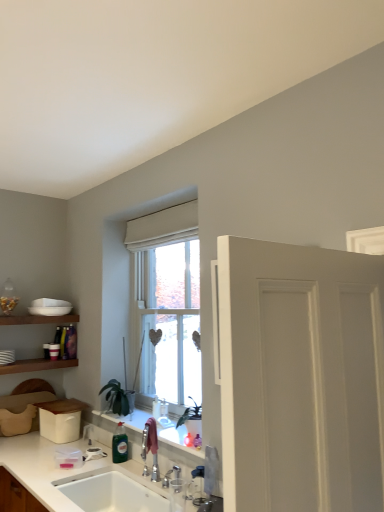
The width and height of the screenshot is (384, 512). Describe the element at coordinates (57, 469) in the screenshot. I see `white glossy countertop at lower center` at that location.

Find the location of a particular element. This screenshot has width=384, height=512. green matte plant at center is located at coordinates (118, 398).

Identify the location of white matte door at right. (301, 377).

From a real-world perspective, who is located lower, white glossy countertop at lower center or green matte plant at center?

white glossy countertop at lower center.

Who is smaller, white glossy countertop at lower center or green matte plant at center?

green matte plant at center.

Would you say white glossy countertop at lower center is to the left or to the right of green matte plant at center in the picture?

white glossy countertop at lower center is positioned on green matte plant at center's right side.

Is point (52, 506) positioned after point (112, 410)?

No, (52, 506) is in front of (112, 410).

From the image's perspective, is green glass bottle at sink beneath white glossy countertop at lower center?

No.

Looking at this image, can you confirm if green glass bottle at sink is smaller than white glossy countertop at lower center?

Yes.

Which is behind, point (123, 459) or point (79, 448)?

Point (79, 448)

How many degrees apart are the facing directions of green glass bottle at sink and white glossy countertop at lower center?

The angle between the facing direction of green glass bottle at sink and the facing direction of white glossy countertop at lower center is 3.65 degrees.

Is white matte door at right thinner than green glass bottle at sink?

Yes, white matte door at right is thinner than green glass bottle at sink.

Does white matte door at right have a larger size compared to green glass bottle at sink?

Indeed, white matte door at right has a larger size compared to green glass bottle at sink.

Relative to green glass bottle at sink, is white matte door at right in front or behind?

white matte door at right is in front of green glass bottle at sink.

Between point (30, 467) and point (140, 490), which one is positioned behind?

Point (30, 467)

Considering the relative sizes of white glossy countertop at lower center and white ceramic sink at lower left in the image provided, is white glossy countertop at lower center shorter than white ceramic sink at lower left?

Yes.

From a real-world perspective, which object stands above the other?

From a 3D spatial view, white glossy countertop at lower center is above.

From the image's perspective, relative to white glossy countertop at lower center, is white matte door at right above or below?

white matte door at right is situated higher than white glossy countertop at lower center in the image.

Considering the sizes of white matte door at right and white glossy countertop at lower center in the image, is white matte door at right taller or shorter than white glossy countertop at lower center?

white matte door at right is taller than white glossy countertop at lower center.

Looking at this image, who is bigger, white matte door at right or white glossy countertop at lower center?

white glossy countertop at lower center.

You are a GUI agent. You are given a task and a screenshot of the screen. Output one action in this format:
    pyautogui.click(x=<x>, y=<y>)
    Task: Click on the sink that is on the right side of green matte plant at center
    
    Given the screenshot: What is the action you would take?
    point(112,493)

Which object is further away from the camera, green matte plant at center or white ceramic sink at lower left?

green matte plant at center is further from the camera.

Is green matte plant at center wider than white ceramic sink at lower left?

No.

Relative to green glass bottle at sink, is white ceramic sink at lower left in front or behind?

In the image, white ceramic sink at lower left appears in front of green glass bottle at sink.

From a real-world perspective, is white ceramic sink at lower left located higher than green glass bottle at sink?

No, from a real-world perspective, white ceramic sink at lower left is not over green glass bottle at sink

Would you consider white ceramic sink at lower left to be distant from green glass bottle at sink?

No, white ceramic sink at lower left is not far from green glass bottle at sink.

Is white ceramic sink at lower left oriented away from green glass bottle at sink?

white ceramic sink at lower left does not have its back to green glass bottle at sink.

At what (x,y) coordinates should I click in order to perform the action: click on countertop that is below the green matte plant at center (from the image's perspective). Please return your answer as a coordinate pair (x, y). This screenshot has height=512, width=384. Looking at the image, I should click on (57, 469).

At what (x,y) coordinates should I click in order to perform the action: click on bottle behind the white glossy countertop at lower center. Please return your answer as a coordinate pair (x, y). Looking at the image, I should click on (119, 448).

Looking at the image, which one is located further to white ceramic sink at lower left, green glass bottle at sink or white glossy countertop at lower center?

Among the two, green glass bottle at sink is located further to white ceramic sink at lower left.

From the image, which object appears to be farther from white glossy countertop at lower center, white ceramic sink at lower left or green glass bottle at sink?

green glass bottle at sink is further to white glossy countertop at lower center.

When comparing their distances from green glass bottle at sink, does white matte door at right or white ceramic sink at lower left seem further?

white matte door at right is further to green glass bottle at sink.

Looking at the image, which one is located closer to white matte door at right, green matte plant at center or white glossy countertop at lower center?

The object closer to white matte door at right is white glossy countertop at lower center.

From the image, which object appears to be nearer to white ceramic sink at lower left, white glossy countertop at lower center or green matte plant at center?

Based on the image, white glossy countertop at lower center appears to be nearer to white ceramic sink at lower left.

When comparing their distances from green matte plant at center, does green glass bottle at sink or white glossy countertop at lower center seem further?

Based on the image, white glossy countertop at lower center appears to be further to green matte plant at center.

From the image, which object appears to be nearer to white glossy countertop at lower center, green matte plant at center or green glass bottle at sink?

green glass bottle at sink.

When comparing their distances from white glossy countertop at lower center, does white matte door at right or white ceramic sink at lower left seem closer?

Based on the image, white ceramic sink at lower left appears to be nearer to white glossy countertop at lower center.

Locate an element on the screen. This screenshot has width=384, height=512. sink between white glossy countertop at lower center and green glass bottle at sink from front to back is located at coordinates (112, 493).

Locate an element on the screen. The image size is (384, 512). sink between white matte door at right and green glass bottle at sink from front to back is located at coordinates (112, 493).

Identify the location of sink positioned between white matte door at right and green matte plant at center from near to far. The width and height of the screenshot is (384, 512). (112, 493).

This screenshot has width=384, height=512. What are the coordinates of `bottle positioned between white matte door at right and green matte plant at center from near to far` in the screenshot? It's located at (119, 448).